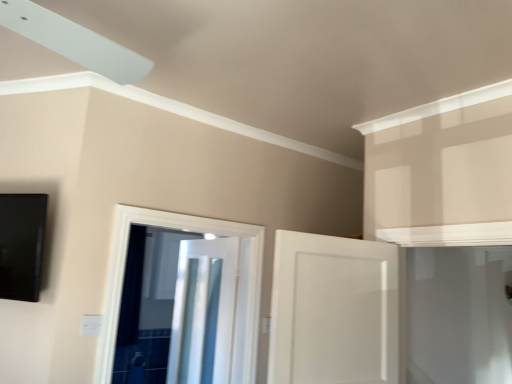
You are a GUI agent. You are given a task and a screenshot of the screen. Output one action in this format:
    pyautogui.click(x=<x>, y=<y>)
    Task: Click on the white glossy door at center, arranged as the third door when viewed from the back
    The height and width of the screenshot is (384, 512).
    Given the screenshot: What is the action you would take?
    pyautogui.click(x=334, y=310)

Find the location of `white glossy door at center, which is the second door from front to back`. white glossy door at center, which is the second door from front to back is located at coordinates (237, 284).

Where is `metallic silver door at center, the first door positioned from the back`? This screenshot has width=512, height=384. metallic silver door at center, the first door positioned from the back is located at coordinates (203, 312).

Would you say metallic silver door at center, the 3th door viewed from the front, is a long distance from white glossy door at center, arranged as the third door when viewed from the back?

metallic silver door at center, the 3th door viewed from the front, is near white glossy door at center, arranged as the third door when viewed from the back, not far away.

Considering the positions of points (206, 254) and (353, 378), is point (206, 254) closer to camera compared to point (353, 378)?

That is False.

Looking at their sizes, would you say metallic silver door at center, the first door positioned from the back, is wider or thinner than white glossy door at center, arranged as the third door when viewed from the back?

metallic silver door at center, the first door positioned from the back, is thinner than white glossy door at center, arranged as the third door when viewed from the back.

How different are the orientations of metallic silver door at center, the 3th door viewed from the front, and white glossy door at center, positioned as the first door in front-to-back order, in degrees?

The angle between the facing direction of metallic silver door at center, the 3th door viewed from the front, and the facing direction of white glossy door at center, positioned as the first door in front-to-back order, is 85.8 degrees.

How different are the orientations of white glossy door at center, arranged as the third door when viewed from the back, and metallic silver door at center, the 3th door viewed from the front, in degrees?

85.8 degrees.

Is white glossy door at center, arranged as the third door when viewed from the back, taller or shorter than metallic silver door at center, the 3th door viewed from the front?

In the image, white glossy door at center, arranged as the third door when viewed from the back, appears to be shorter than metallic silver door at center, the 3th door viewed from the front.

Does white glossy door at center, positioned as the first door in front-to-back order, contain metallic silver door at center, the first door positioned from the back?

No, metallic silver door at center, the first door positioned from the back, is located outside of white glossy door at center, positioned as the first door in front-to-back order.

Which is more to the right, white glossy door at center, positioned as the first door in front-to-back order, or metallic silver door at center, the first door positioned from the back?

From the viewer's perspective, white glossy door at center, positioned as the first door in front-to-back order, appears more on the right side.

Which is in front, point (99, 372) or point (189, 304)?

Positioned in front is point (99, 372).

Consider the image. Is there a large distance between white glossy door at center, which is the second door from front to back, and metallic silver door at center, the 3th door viewed from the front?

No, white glossy door at center, which is the second door from front to back, is in close proximity to metallic silver door at center, the 3th door viewed from the front.

From the image's perspective, who appears lower, white glossy door at center, which is the 2th door from back to front, or metallic silver door at center, the first door positioned from the back?

metallic silver door at center, the first door positioned from the back, from the image's perspective.

From the picture: Does white glossy door at center, which is the 2th door from back to front, have a lesser height compared to metallic silver door at center, the 3th door viewed from the front?

Indeed, white glossy door at center, which is the 2th door from back to front, has a lesser height compared to metallic silver door at center, the 3th door viewed from the front.

Between white glossy door at center, which is the 2th door from back to front, and white glossy door at center, arranged as the third door when viewed from the back, which one has less height?

white glossy door at center, arranged as the third door when viewed from the back, is shorter.

Which object is positioned more to the left, white glossy door at center, which is the 2th door from back to front, or white glossy door at center, positioned as the first door in front-to-back order?

Positioned to the left is white glossy door at center, which is the 2th door from back to front.

Is white glossy door at center, which is the second door from front to back, facing away from white glossy door at center, arranged as the third door when viewed from the back?

No, white glossy door at center, which is the second door from front to back,'s orientation is not away from white glossy door at center, arranged as the third door when viewed from the back.

Considering the points (220, 372) and (247, 239), which point is behind, point (220, 372) or point (247, 239)?

The point (247, 239) is more distant.

Is metallic silver door at center, the first door positioned from the back, inside the boundaries of white glossy door at center, which is the second door from front to back, or outside?

metallic silver door at center, the first door positioned from the back, is spatially situated outside white glossy door at center, which is the second door from front to back.

Who is more distant, metallic silver door at center, the first door positioned from the back, or white glossy door at center, which is the second door from front to back?

metallic silver door at center, the first door positioned from the back, is further away from the camera.

Choose the correct answer: Is white glossy door at center, positioned as the first door in front-to-back order, inside white glossy door at center, which is the second door from front to back, or outside it?

white glossy door at center, positioned as the first door in front-to-back order, is outside white glossy door at center, which is the second door from front to back.

Between white glossy door at center, positioned as the first door in front-to-back order, and white glossy door at center, which is the second door from front to back, which one appears on the right side from the viewer's perspective?

Positioned to the right is white glossy door at center, positioned as the first door in front-to-back order.

Considering the relative sizes of white glossy door at center, positioned as the first door in front-to-back order, and white glossy door at center, which is the 2th door from back to front, in the image provided, is white glossy door at center, positioned as the first door in front-to-back order, smaller than white glossy door at center, which is the 2th door from back to front,?

No.

Is white glossy door at center, positioned as the first door in front-to-back order, further to the viewer compared to white glossy door at center, which is the second door from front to back?

No, it is not.

The image size is (512, 384). There is a metallic silver door at center, the 3th door viewed from the front. Identify the location of the 2nd door above it (from a real-world perspective). (334, 310).

Locate an element on the screen. This screenshot has height=384, width=512. door that is the 2nd one when counting downward from the white glossy door at center, positioned as the first door in front-to-back order (from the image's perspective) is located at coordinates (203, 312).

From the image, which object appears to be nearer to metallic silver door at center, the 3th door viewed from the front, white glossy door at center, which is the 2th door from back to front, or white glossy door at center, positioned as the first door in front-to-back order?

The object closer to metallic silver door at center, the 3th door viewed from the front, is white glossy door at center, which is the 2th door from back to front.

Estimate the real-world distances between objects in this image. Which object is closer to white glossy door at center, which is the 2th door from back to front, white glossy door at center, arranged as the third door when viewed from the back, or metallic silver door at center, the first door positioned from the back?

metallic silver door at center, the first door positioned from the back, is positioned closer to the anchor white glossy door at center, which is the 2th door from back to front.

Which object lies further to the anchor point white glossy door at center, arranged as the third door when viewed from the back, metallic silver door at center, the 3th door viewed from the front, or white glossy door at center, which is the second door from front to back?

Based on the image, metallic silver door at center, the 3th door viewed from the front, appears to be further to white glossy door at center, arranged as the third door when viewed from the back.

From the picture: Looking at the image, which one is located further to metallic silver door at center, the first door positioned from the back, white glossy door at center, arranged as the third door when viewed from the back, or white glossy door at center, which is the 2th door from back to front?

Among the two, white glossy door at center, arranged as the third door when viewed from the back, is located further to metallic silver door at center, the first door positioned from the back.

When comparing their distances from white glossy door at center, which is the second door from front to back, does metallic silver door at center, the first door positioned from the back, or white glossy door at center, positioned as the first door in front-to-back order, seem closer?

metallic silver door at center, the first door positioned from the back.

Considering their positions, is white glossy door at center, which is the 2th door from back to front, positioned closer to white glossy door at center, positioned as the first door in front-to-back order, than metallic silver door at center, the 3th door viewed from the front?

white glossy door at center, which is the 2th door from back to front.

Where is `door located between metallic silver door at center, the first door positioned from the back, and white glossy door at center, arranged as the third door when viewed from the back, in the left-right direction`? Image resolution: width=512 pixels, height=384 pixels. door located between metallic silver door at center, the first door positioned from the back, and white glossy door at center, arranged as the third door when viewed from the back, in the left-right direction is located at coordinates (237, 284).